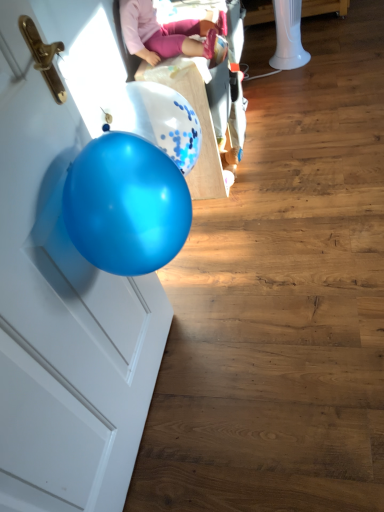
Locate an element on the screen. This screenshot has height=512, width=384. vacant region to the right of white plastic baby carriage at upper center is located at coordinates (302, 113).